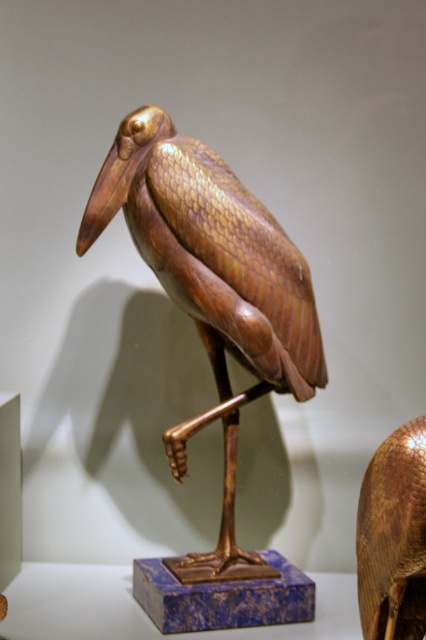
Question: Is shiny gold bird at center closer to camera compared to gold textured bird at center?

Choices:
 (A) yes
 (B) no

Answer: (B)

Question: Does shiny gold bird at center appear on the left side of gold textured bird at center?

Choices:
 (A) yes
 (B) no

Answer: (A)

Question: Is shiny gold bird at center positioned behind gold textured bird at center?

Choices:
 (A) no
 (B) yes

Answer: (B)